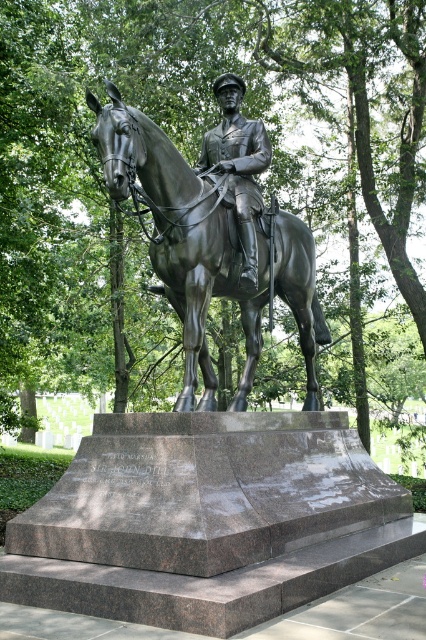
You are a visitor at the memorial park and want to take a photo of the bronze statue of horse at center without the bronze statue at center blocking the view. Is this possible given their positions?

The bronze statue of horse at center is positioned under bronze statue at center, so the bronze statue at center will block the view of the horse statue. Therefore, it is not possible to take a photo of the bronze statue of horse at center without the bronze statue at center blocking the view.

You are a tour guide explaining the memorial site to a group. You mention both the bronze statue of horse at center and the bronze statue at center. Which one is larger in size?

The bronze statue of horse at center is bigger than bronze statue at center.

You are a sculptor planning to create a miniature version of the bronze statue of horse at center and the bronze statue at center. If you want both miniatures to have the same height, which one should you make wider?

The bronze statue of horse at center should be made wider because the bronze statue of horse at center is originally larger in width than the bronze statue at center.